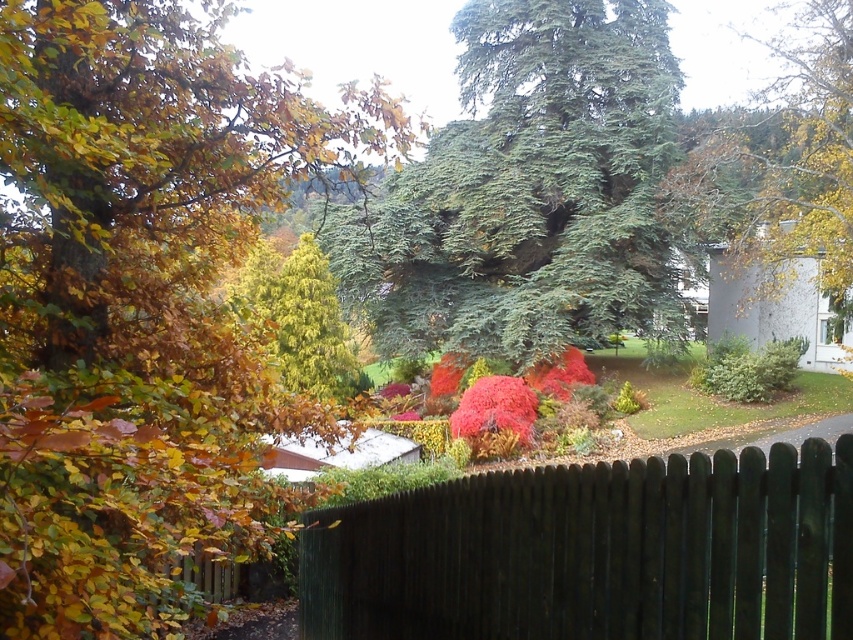
The width and height of the screenshot is (853, 640). Find the location of `dark brown wooden fence at lower center`. dark brown wooden fence at lower center is located at coordinates (595, 552).

How distant is dark brown wooden fence at lower center from green needle-like at center?

dark brown wooden fence at lower center is 29.15 meters away from green needle-like at center.

Is point (428, 513) positioned in front of point (635, 211)?

Yes.

Identify the location of dark brown wooden fence at lower center. The image size is (853, 640). (595, 552).